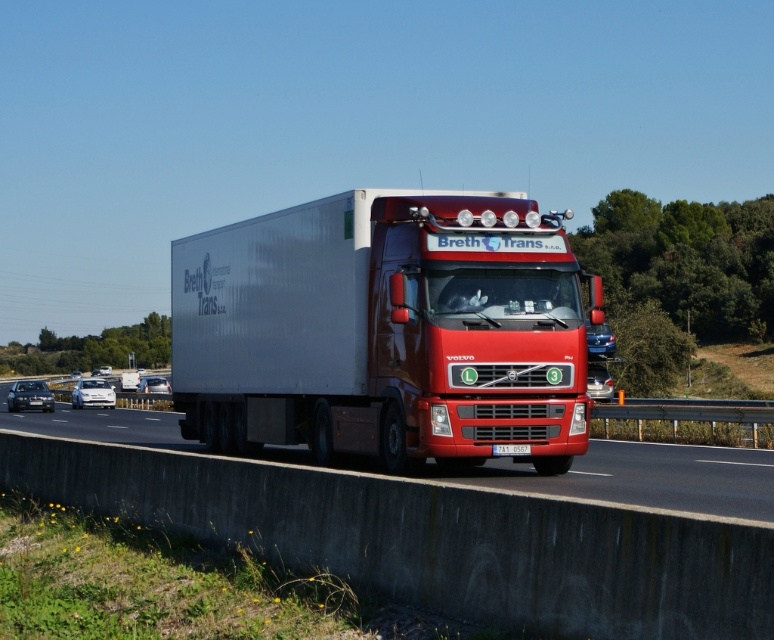
From the picture: You are a driver who wants to ensure your vehicle is properly positioned on the highway. Given the presence of the metallic gray highway at center and the black plastic license plate at center, which object should you focus on to maintain your vehicle within the correct lane?

You should focus on the metallic gray highway at center since it has a larger size compared to the black plastic license plate at center, which helps in determining the lane boundaries.

You are a driver trying to read the license plate of the truck. However, the metallic silver trailer at center is blocking your view. Can you see the black plastic license plate at center clearly?

The metallic silver trailer at center is positioned over the black plastic license plate at center, so the trailer is blocking the license plate, making it difficult to see the black plastic license plate at center clearly.